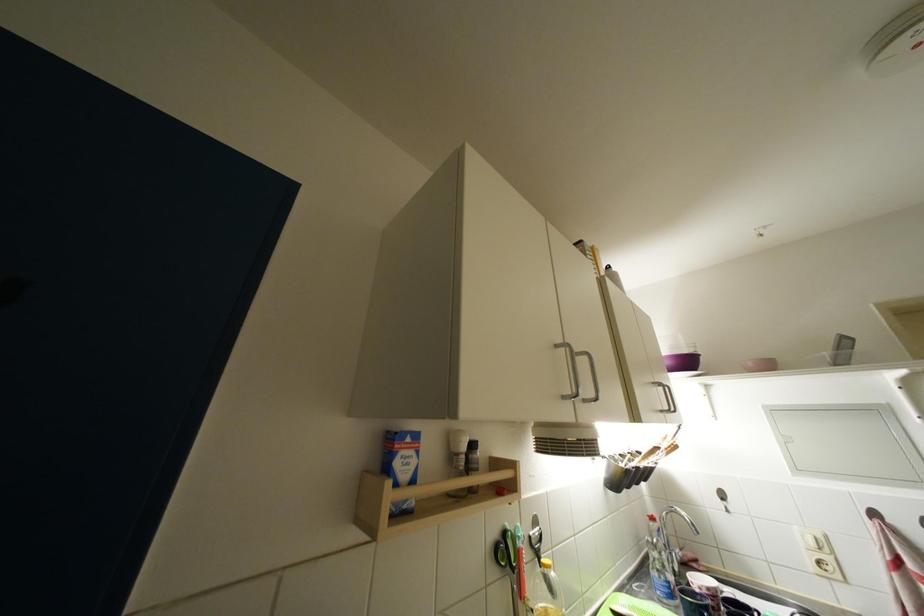
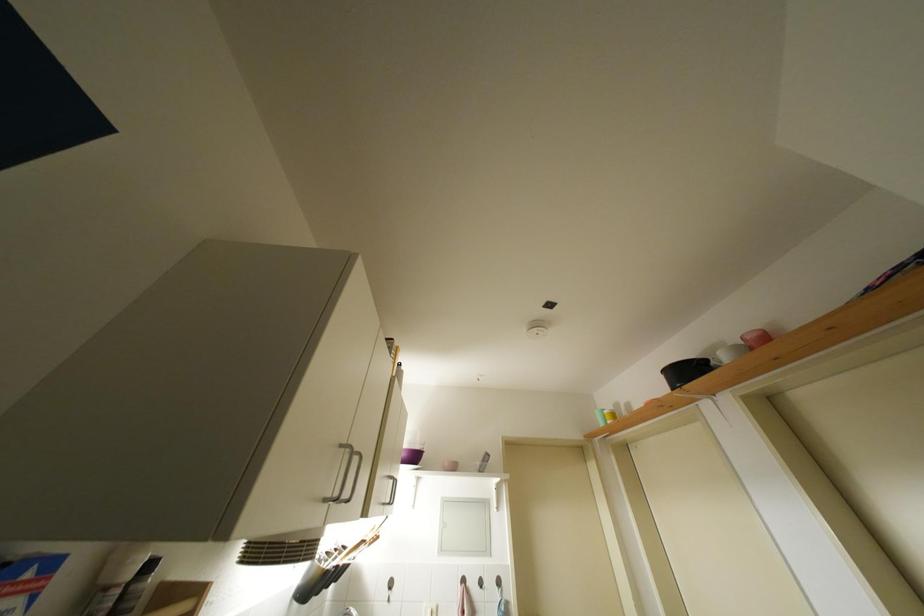
Locate, in the second image, the point that corresponds to (675,367) in the first image.

(410, 459)